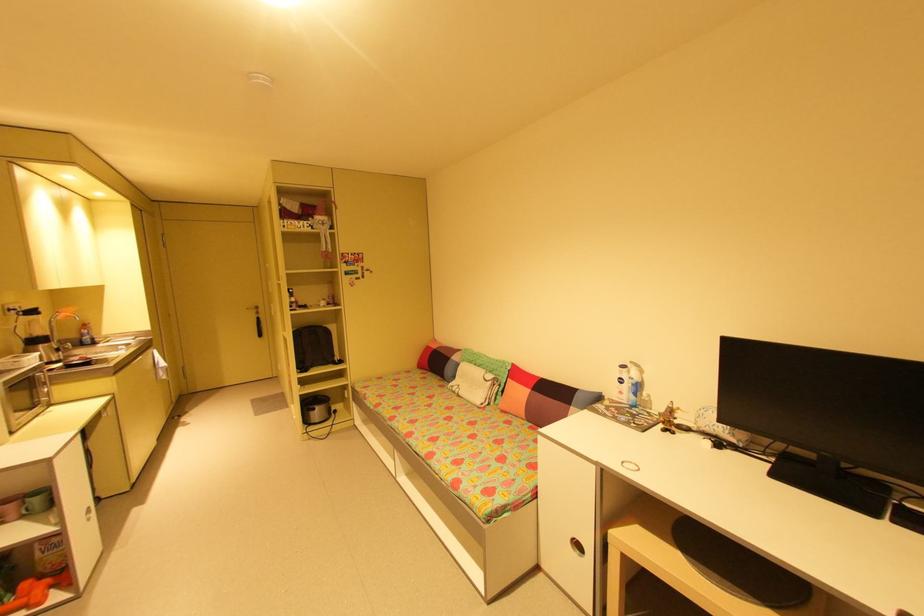
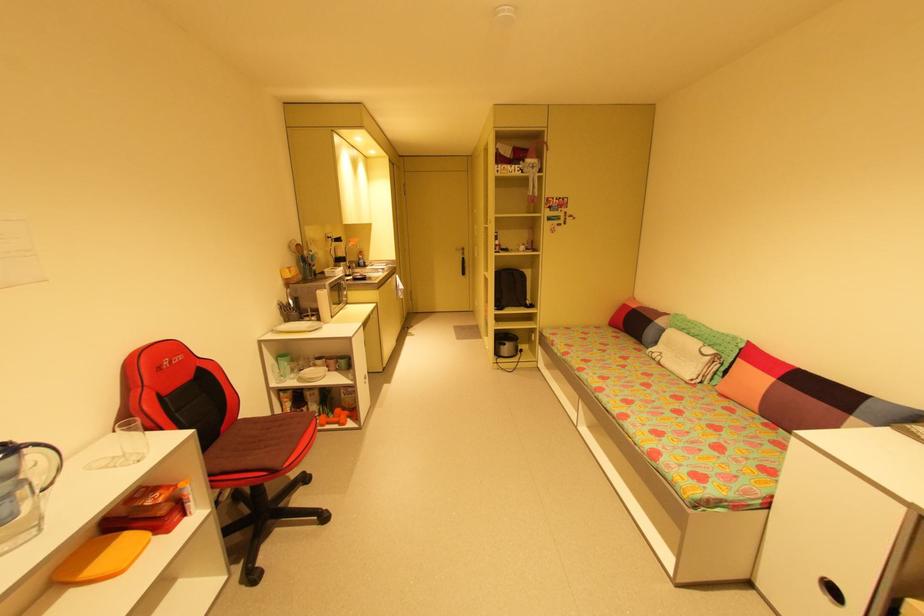
In the second image, find the point that corresponds to (315,413) in the first image.

(505, 347)